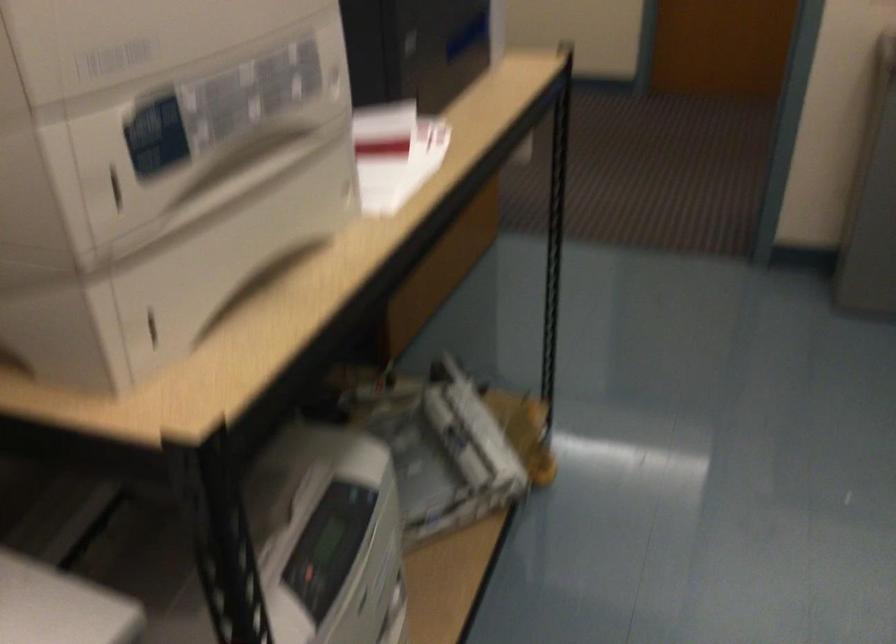
Identify the location of printer panel handle. The width and height of the screenshot is (896, 644). (151, 327).